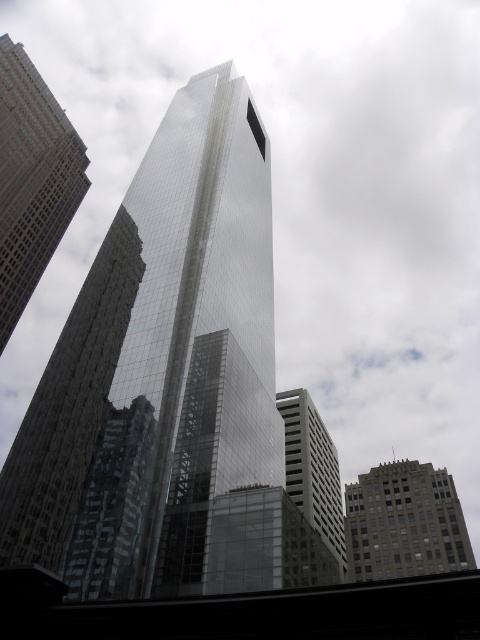
From the picture: Is gray concrete building at lower right in front of white glass building at center?

No, gray concrete building at lower right is behind white glass building at center.

Is gray concrete building at lower right wider than white glass building at center?

Yes, gray concrete building at lower right is wider than white glass building at center.

Where is `gray concrete building at lower right`? Image resolution: width=480 pixels, height=640 pixels. gray concrete building at lower right is located at coordinates pyautogui.click(x=405, y=522).

Looking at this image, does reflective glass skyscraper at center have a lesser width compared to gray concrete building at lower right?

Incorrect, reflective glass skyscraper at center's width is not less than gray concrete building at lower right's.

Between point (272, 540) and point (355, 564), which one is positioned in front?

Positioned in front is point (272, 540).

Between point (166, 528) and point (467, 534), which one is positioned in front?

Point (166, 528)

Find the location of a particular element. Image resolution: width=480 pixels, height=640 pixels. reflective glass skyscraper at center is located at coordinates (170, 387).

At what (x,y) coordinates should I click in order to perform the action: click on glassy reflective skyscraper at left. Please return your answer as a coordinate pair (x, y). The image size is (480, 640). Looking at the image, I should click on (32, 179).

Who is shorter, glassy reflective skyscraper at left or white glass building at center?

Standing shorter between the two is white glass building at center.

Is point (0, 227) farther from viewer compared to point (327, 538)?

That is True.

This screenshot has height=640, width=480. In order to click on glassy reflective skyscraper at left in this screenshot , I will do `click(32, 179)`.